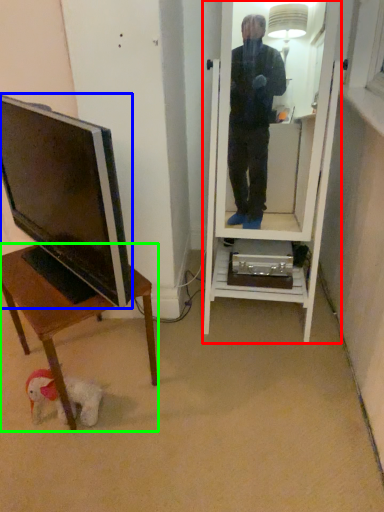
Question: Which is farther away from mirror (highlighted by a red box)? television (highlighted by a blue box) or desk (highlighted by a green box)?

Choices:
 (A) television
 (B) desk

Answer: (A)